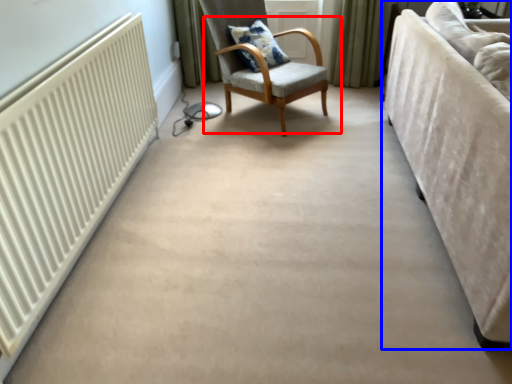
Question: Which object is closer to the camera taking this photo, chair (highlighted by a red box) or studio couch (highlighted by a blue box)?

Choices:
 (A) chair
 (B) studio couch

Answer: (B)